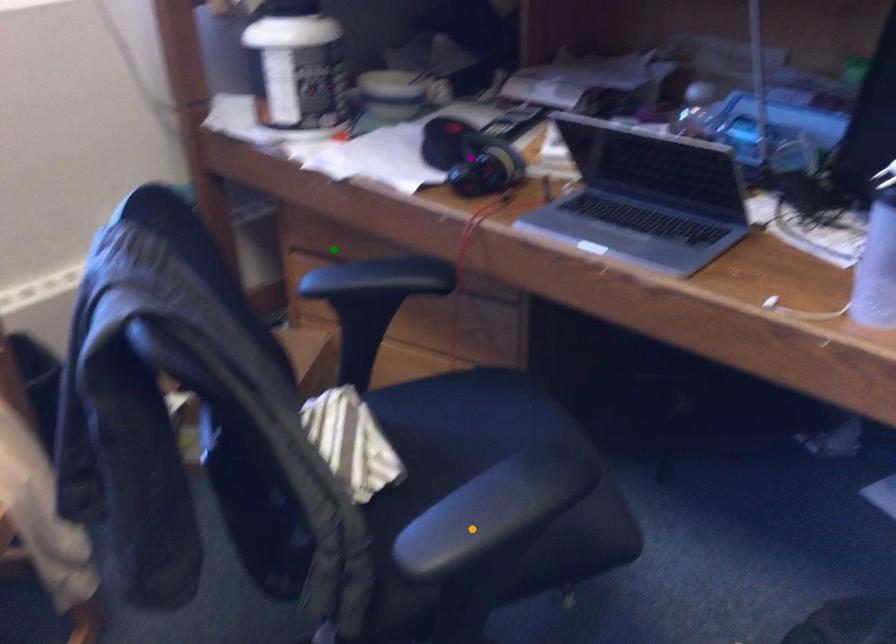
Order these from farthest to nearest:
purple point, green point, orange point

green point < purple point < orange point